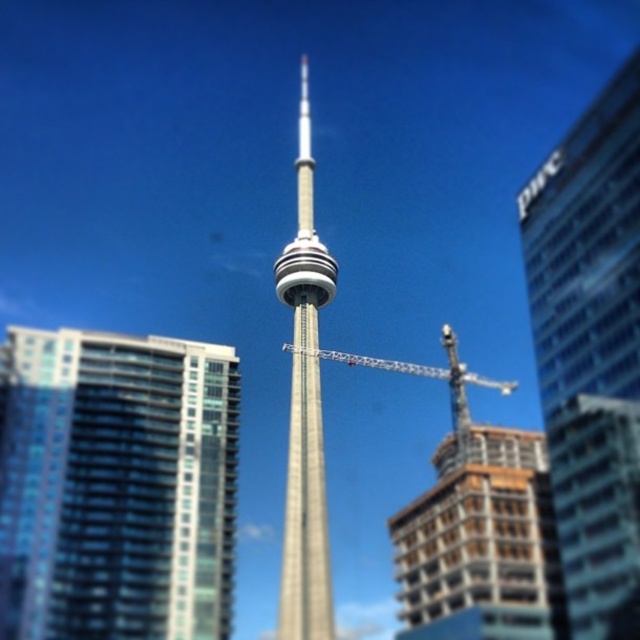
Based on the cityscape image with the CN Tower, which object corresponds to the coordinates point at (x=589, y=349)?

The coordinates point at (x=589, y=349) corresponds to the glassy reflective building at right.

You are standing at the base of the CN Tower and want to take a photo of the point at coordinates point (x=579, y=554). If your camera has a maximum zoom range of 100 meters, will you be able to capture that point clearly in your photo?

The point at coordinates point (x=579, y=554) is 87.52 meters away from the camera. Since the camera can zoom up to 100 meters, you will be able to capture the point clearly within the photo.

You are standing in front of the CN Tower and looking at the cityscape. There are two points marked in the image. The first point is at coordinates point (298, 211) and the second point is at point (451, 422). Which point is closer to you?

Point (298, 211) is closer to you because it is further to the viewer than point (451, 422).